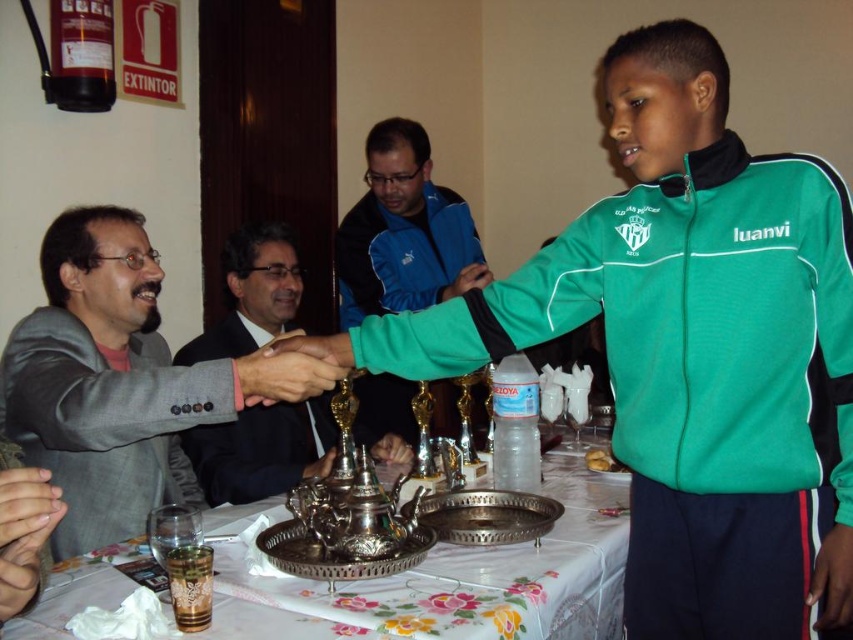
From the picture: You are a waiter holding a 2.5 feet long platter of appetizers. You need to place it on the silver metallic tray at center. Can you fit it there?

The silver metallic tray at center is 3.42 feet from camera. Since the platter is 2.5 feet long, it should fit as the tray is larger than the platter.